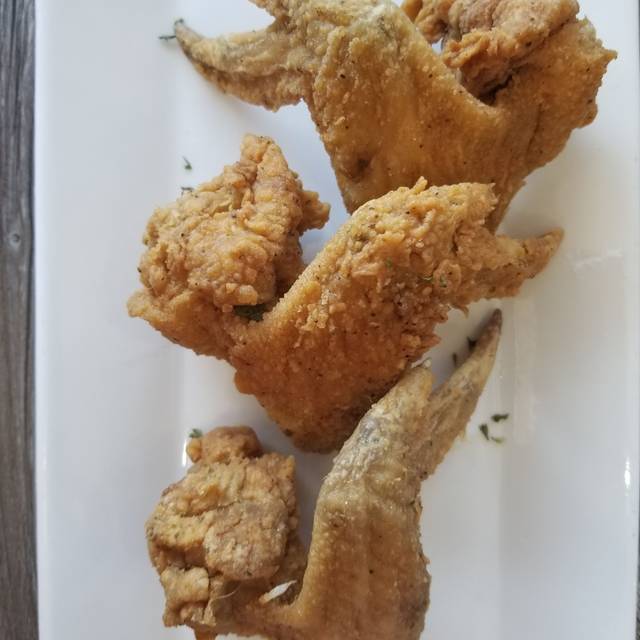
At what (x,y) coordinates should I click in order to perform the action: click on crumb. Please return your answer as a coordinate pair (x, y). This screenshot has width=640, height=640. Looking at the image, I should click on (482, 429), (508, 413), (474, 342), (461, 354), (196, 161).